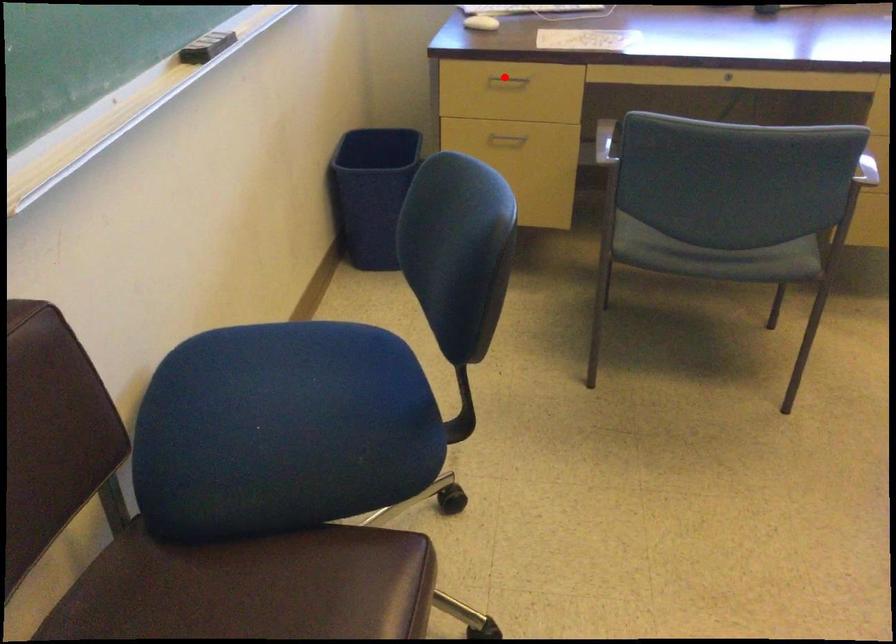
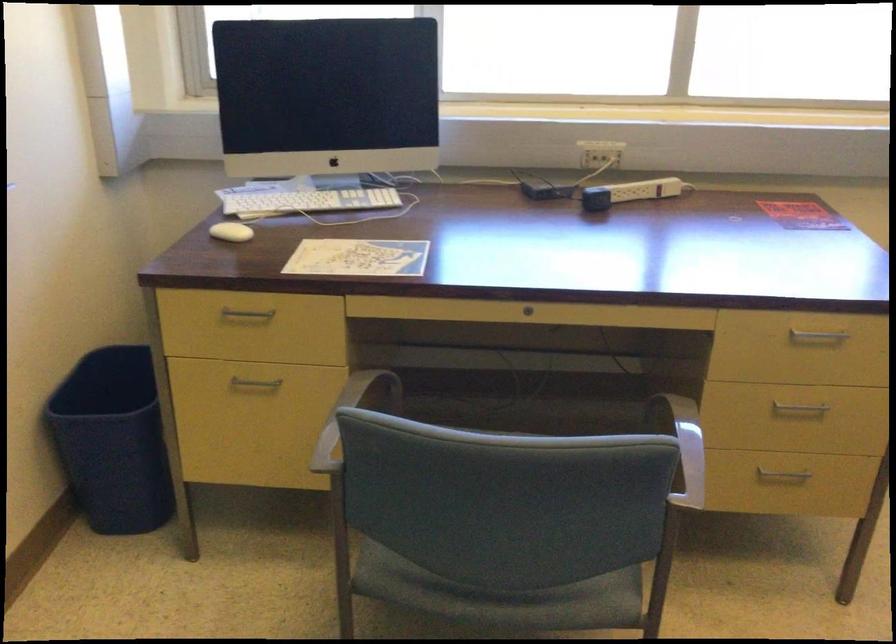
Find the pixel in the second image that matches the highlighted location in the first image.

(247, 313)